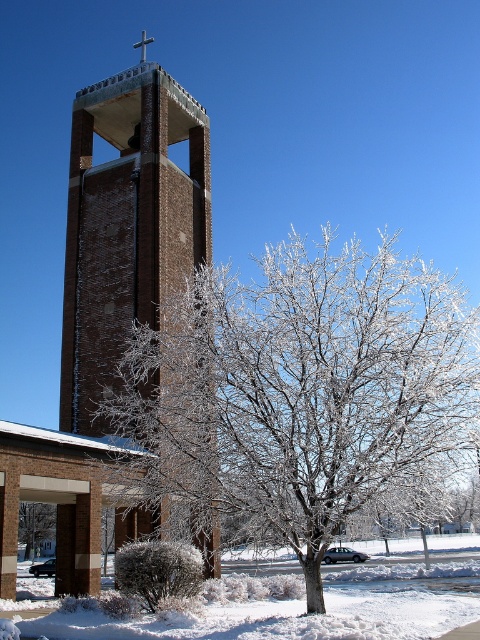
Is point (373, 422) more distant than point (144, 515)?

No, it is not.

Is frosted white tree at center below brick tower at center?

Yes.

Is point (304, 250) positioned after point (69, 390)?

Yes, point (304, 250) is farther from viewer.

Find the location of a particular element. frosted white tree at center is located at coordinates (300, 388).

Is brick tower at center below frosted bush at lower center?

No, brick tower at center is not below frosted bush at lower center.

Can you confirm if brick tower at center is wider than frosted bush at lower center?

Correct, the width of brick tower at center exceeds that of frosted bush at lower center.

What do you see at coordinates (127, 225) in the screenshot? The height and width of the screenshot is (640, 480). I see `brick tower at center` at bounding box center [127, 225].

The image size is (480, 640). What are the coordinates of `brick tower at center` in the screenshot? It's located at (127, 225).

Is white frosty snow at lower center wider than frosted bush at lower center?

Yes, white frosty snow at lower center is wider than frosted bush at lower center.

Is white frosty snow at lower center bigger than frosted bush at lower center?

Indeed, white frosty snow at lower center has a larger size compared to frosted bush at lower center.

Where is `white frosty snow at lower center`? This screenshot has height=640, width=480. white frosty snow at lower center is located at coordinates pos(301,608).

The height and width of the screenshot is (640, 480). I want to click on white frosty snow at lower center, so click(x=301, y=608).